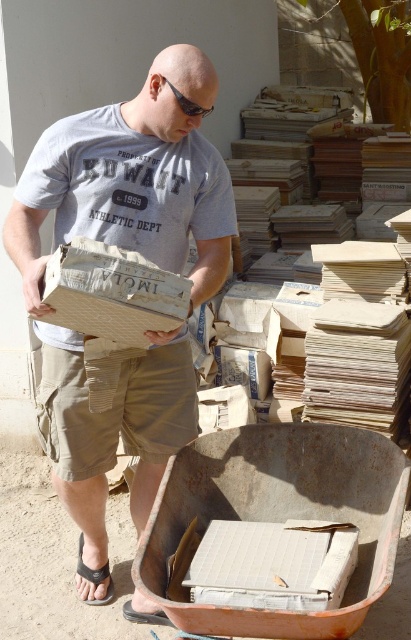
Question: Which object appears farthest from the camera in this image?

Choices:
 (A) khaki cotton shorts at center
 (B) matte cardboard box at center

Answer: (A)

Question: Is khaki cotton shorts at center thinner than white corrugated cardboard box at lower center?

Choices:
 (A) yes
 (B) no

Answer: (A)

Question: Considering the real-world distances, which object is farthest from the black fabric sandal at lower left?

Choices:
 (A) white corrugated cardboard box at lower center
 (B) matte cardboard box at center
 (C) khaki cotton shorts at center

Answer: (A)

Question: Does khaki cotton shorts at center appear on the right side of white corrugated cardboard box at lower center?

Choices:
 (A) no
 (B) yes

Answer: (A)

Question: Can you confirm if khaki cotton shorts at center is bigger than black fabric sandal at lower left?

Choices:
 (A) no
 (B) yes

Answer: (B)

Question: Which object is closer to the camera taking this photo?

Choices:
 (A) white corrugated cardboard box at lower center
 (B) black fabric sandal at lower left
 (C) khaki cotton shorts at center
 (D) matte cardboard box at center

Answer: (A)